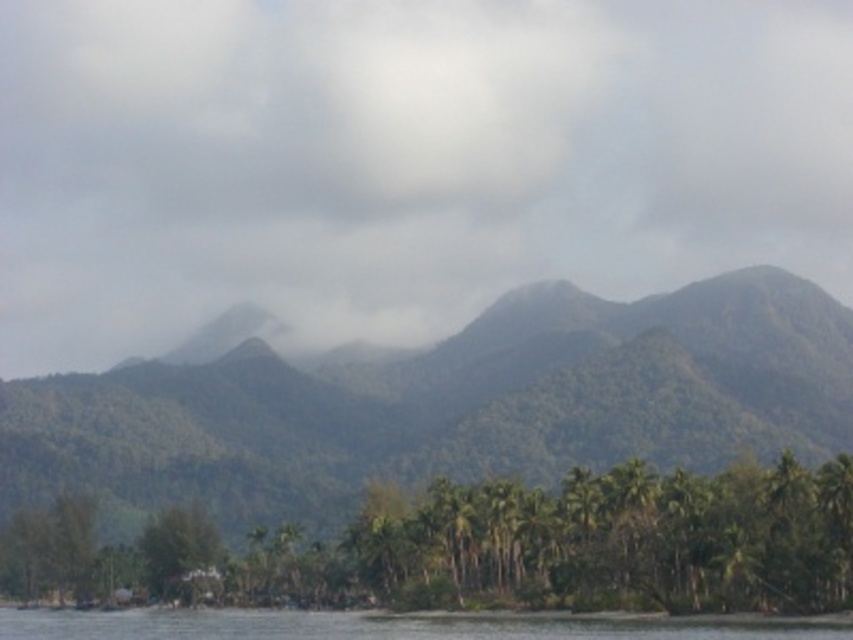
Question: Can you confirm if white fluffy cloud at upper center is bigger than clear water at lower center?

Choices:
 (A) yes
 (B) no

Answer: (A)

Question: Which of the following is the closest to the observer?

Choices:
 (A) (697, 556)
 (B) (259, 618)

Answer: (A)

Question: Does green leafy mountain at center appear over clear water at lower center?

Choices:
 (A) yes
 (B) no

Answer: (A)

Question: Estimate the real-world distances between objects in this image. Which object is farther from the white fluffy cloud at upper center?

Choices:
 (A) green leafy trees at lower center
 (B) clear water at lower center

Answer: (B)

Question: Which object is the farthest from the white fluffy cloud at upper center?

Choices:
 (A) clear water at lower center
 (B) green leafy mountain at center

Answer: (A)

Question: Is white fluffy cloud at upper center further to camera compared to green leafy mountain at center?

Choices:
 (A) yes
 (B) no

Answer: (A)